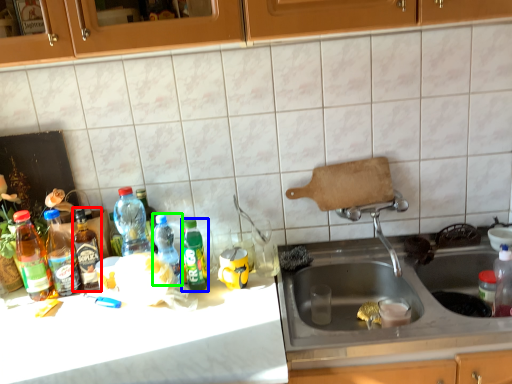
Question: Considering the real-world distances, which object is farthest from bottle (highlighted by a red box)? bottle (highlighted by a blue box) or bottle (highlighted by a green box)?

Choices:
 (A) bottle
 (B) bottle

Answer: (A)